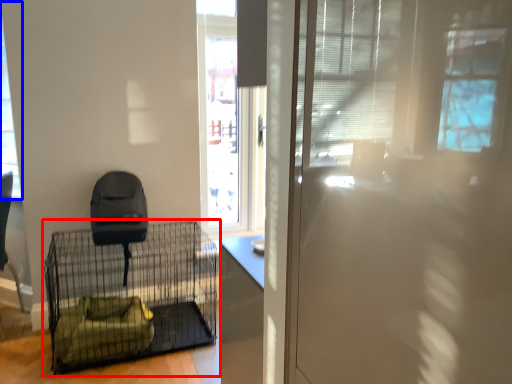
Question: Which of the following is the closest to the observer, furniture (highlighted by a red box) or window (highlighted by a blue box)?

Choices:
 (A) furniture
 (B) window

Answer: (A)